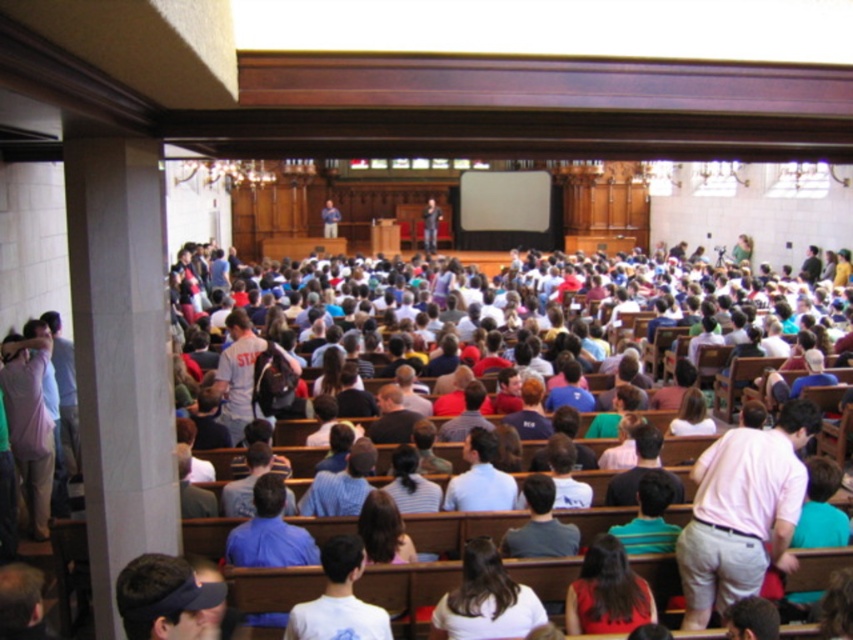
You are sitting at the back of the lecture hall and notice a person with dark brown hair at lower center. Based on their position, can you estimate how far they are from the stage?

The dark brown hair at lower center is located at point [607,593], which is approximately 12 meters away from the stage.

You are sitting in the audience of the lecture hall and want to take a photo of the presenter at the center of the stage. The camera you have can only focus on objects wider than 10 cm. Do you think the dark brown hair at center and light blue shirt at center will both be in focus?

The dark brown hair at center is wider than the light blue shirt at center. Since the camera can focus on objects wider than 10 cm, if the dark brown hair at center is wider than 10 cm, then both would be in focus. However, if the dark brown hair at center is exactly at 10 cm or narrower, only the light blue shirt at center might not be in focus. But since the description only states the dark brown hair is wider than the light blue shirt, we cannot determine exact measurements. Therefore, it is uncertain if

You are standing in the lecture hall and see the point marked at coordinates [338,600]. What object is located at this point?

The point at coordinates [338,600] corresponds to the white cotton shirt at center.